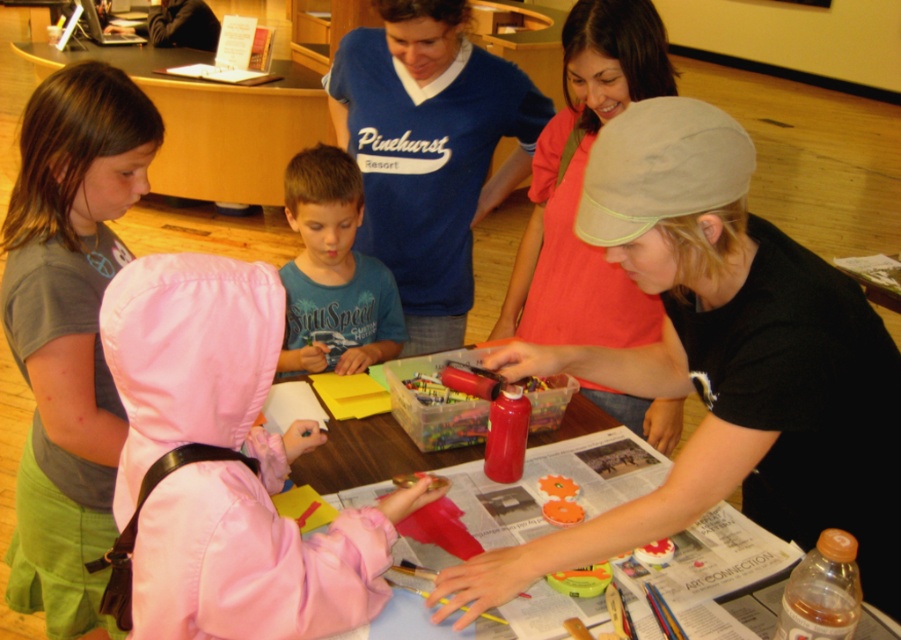
Question: Considering the real-world distances, which object is closest to the gray fabric shirt at left?

Choices:
 (A) matte pink hoodie at center
 (B) blue cotton shirt at center
 (C) blue jersey at center

Answer: (B)

Question: Estimate the real-world distances between objects in this image. Which object is farther from the blue cotton shirt at center?

Choices:
 (A) translucent plastic table at center
 (B) gray fabric shirt at left

Answer: (B)

Question: Is gray fabric shirt at left further to camera compared to blue jersey at center?

Choices:
 (A) no
 (B) yes

Answer: (A)

Question: Estimate the real-world distances between objects in this image. Which object is farther from the translucent plastic table at center?

Choices:
 (A) blue cotton shirt at center
 (B) blue jersey at center
 (C) wooden table at lower center
 (D) matte black cap at upper right

Answer: (C)

Question: Can you confirm if pink satin jacket at lower left is positioned to the right of wooden table at lower center?

Choices:
 (A) yes
 (B) no

Answer: (A)

Question: Does gray fabric shirt at left appear on the left side of matte pink hoodie at center?

Choices:
 (A) yes
 (B) no

Answer: (A)